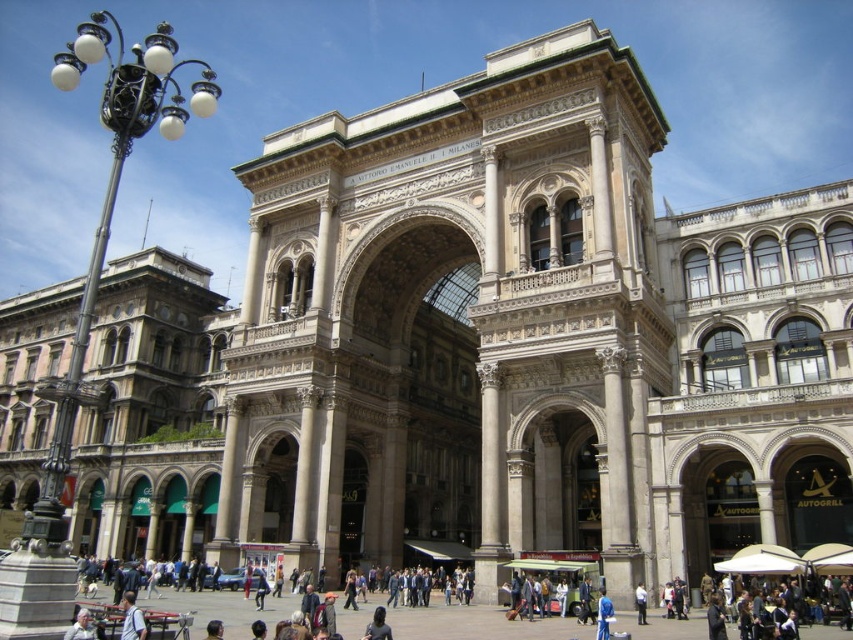
You are standing in the urban square facing the grand building. You notice a person wearing a light blue shirt at center and another with dark brown hair at lower center. Which of these two is positioned more to the left side from your viewpoint?

The light blue shirt at center is positioned to the left of dark brown hair at lower center, so the light blue shirt at center is more to the left.

You are standing in the urban square facing the grand building. You notice two points marked on the facade. The first point is at coordinates point (x=83, y=637) and the second is at point (x=599, y=595). Which of these two points is nearer to your current position?

Point (x=83, y=637) is closer to the camera than point (x=599, y=595), so the first point is nearer to your current position.

You are a photographer standing in the bustling urban square in front of the grand building. You notice a person wearing a light blue shirt at center and someone with dark brown hair at lower center. Which of these two people appears shorter in the photo?

The light blue shirt at center appears shorter than the dark brown hair at lower center because the light blue shirt at center is not as tall as dark brown hair at lower center.